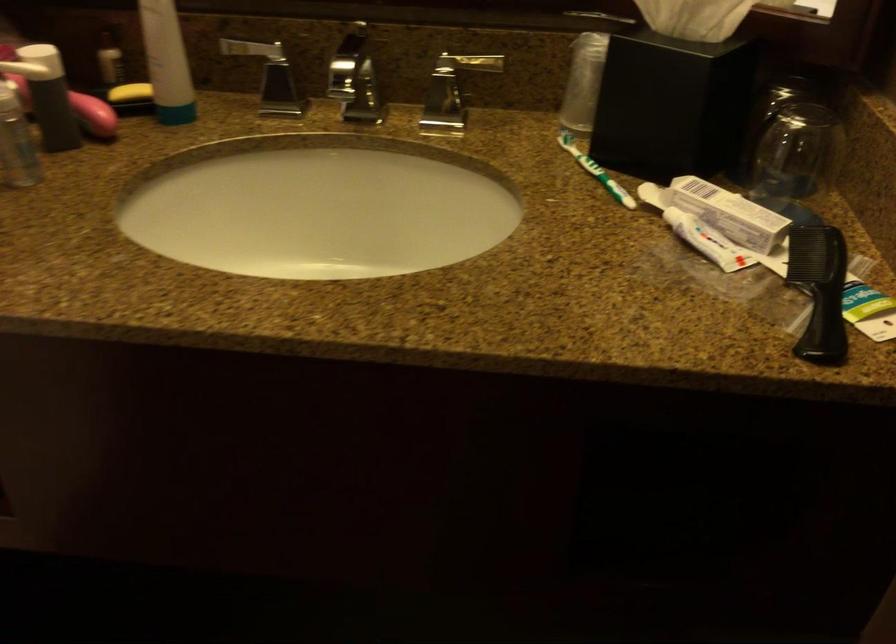
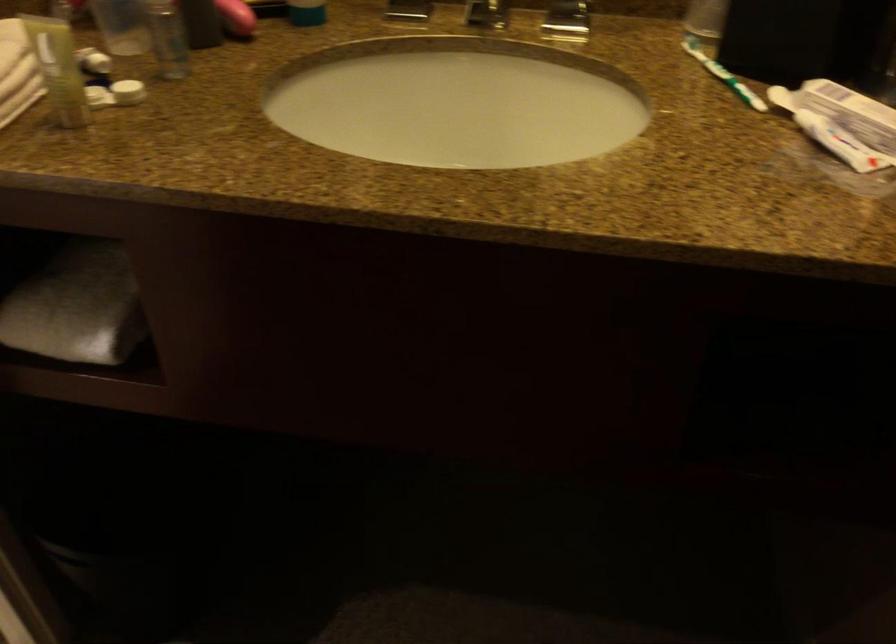
Where in the second image is the point corresponding to point 337,198 from the first image?

(457, 102)